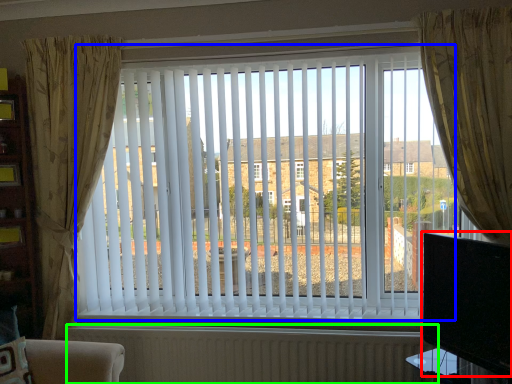
Question: Considering the real-world distances, which object is closest to window screen (highlighted by a red box)? window blind (highlighted by a blue box) or radiator (highlighted by a green box).

Choices:
 (A) window blind
 (B) radiator

Answer: (B)